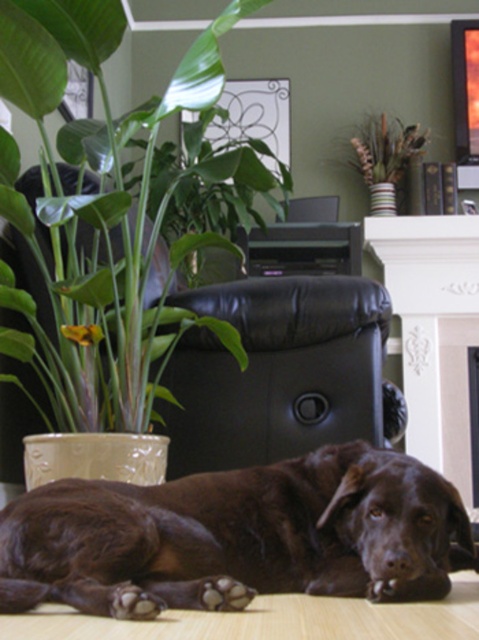
Question: Which of the following is the farthest from the observer?

Choices:
 (A) white painted wood fireplace at upper center
 (B) green leafy plant at left

Answer: (A)

Question: Is brown furry dog at lower center above green leafy plant at left?

Choices:
 (A) no
 (B) yes

Answer: (A)

Question: Does brown furry dog at lower center appear over green leafy plant at left?

Choices:
 (A) yes
 (B) no

Answer: (B)

Question: Which point is closer to the camera?

Choices:
 (A) (58, 412)
 (B) (331, 572)

Answer: (B)

Question: Can you confirm if brown furry dog at lower center is smaller than green leafy plant at left?

Choices:
 (A) no
 (B) yes

Answer: (B)

Question: Which object is closer to the camera taking this photo?

Choices:
 (A) brown furry dog at lower center
 (B) green leafy plant at left
 (C) white painted wood fireplace at upper center

Answer: (A)